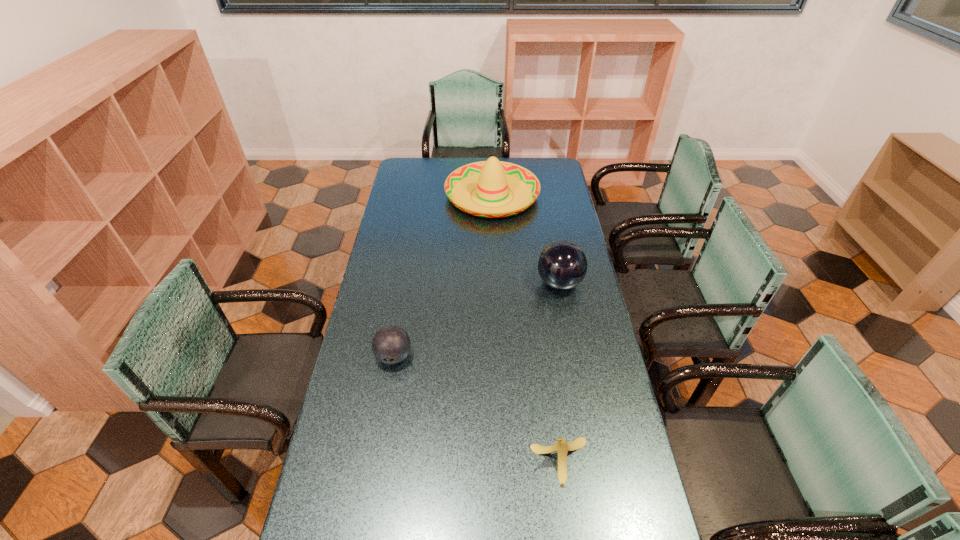
At what (x,y) coordinates should I click in order to perform the action: click on sombrero. Please return your answer as a coordinate pair (x, y). The height and width of the screenshot is (540, 960). Looking at the image, I should click on (492, 178).

The image size is (960, 540). Find the location of `the right bowling ball`. the right bowling ball is located at coordinates (562, 265).

Identify the location of the farther bowling ball. Image resolution: width=960 pixels, height=540 pixels. (562, 265).

The width and height of the screenshot is (960, 540). Find the location of `the leftmost object`. the leftmost object is located at coordinates (391, 344).

In order to click on the left bowling ball in this screenshot , I will do `click(391, 344)`.

Locate an element on the screen. This screenshot has width=960, height=540. banana is located at coordinates (562, 447).

This screenshot has height=540, width=960. Find the location of `vacant area situated on the left of the farthest object`. vacant area situated on the left of the farthest object is located at coordinates (433, 195).

You are a GUI agent. You are given a task and a screenshot of the screen. Output one action in this format:
    pyautogui.click(x=<x>, y=<y>)
    Task: Click on the vacant space located 0.110m on the side of the second farthest object with the finger holes
    
    Given the screenshot: What is the action you would take?
    pyautogui.click(x=509, y=283)

This screenshot has height=540, width=960. In order to click on vacant space situated on the side of the second farthest object with the finger holes in this screenshot , I will do `click(439, 283)`.

The height and width of the screenshot is (540, 960). In order to click on free region located 0.210m on the side of the second farthest object with the finger holes in this screenshot , I will do `click(484, 283)`.